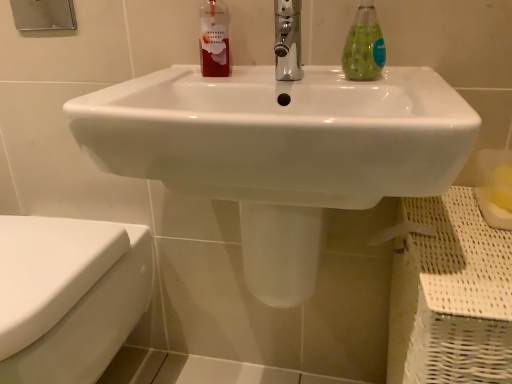
You are a GUI agent. You are given a task and a screenshot of the screen. Output one action in this format:
    pyautogui.click(x=<x>, y=<y>)
    Task: Click on the vacant space to the right of translucent green liquid at sink right
    
    Given the screenshot: What is the action you would take?
    pyautogui.click(x=413, y=79)